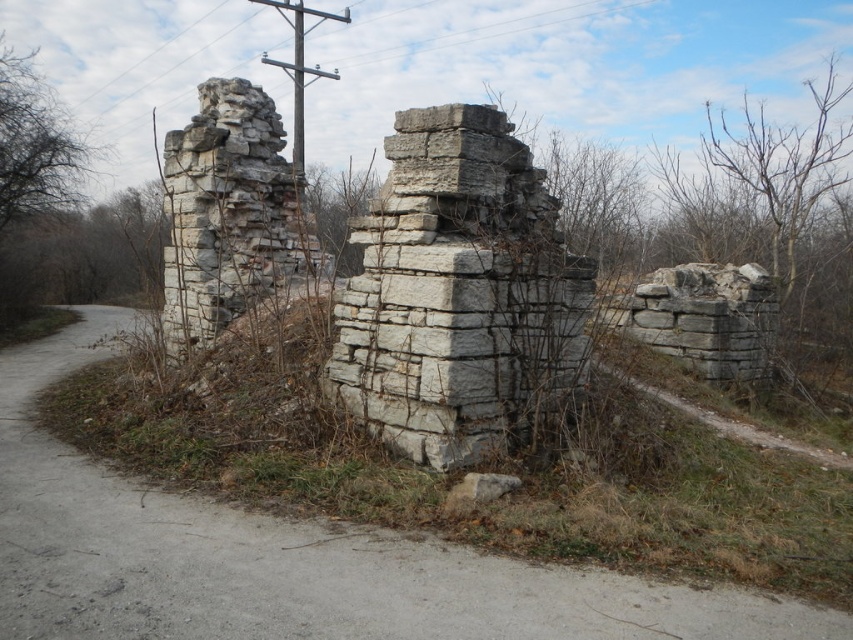
Is gray stone wall at center shorter than gray stone ruins at center?

Yes.

Who is more distant from viewer, (486, 600) or (529, 237)?

The point (529, 237) is behind.

Image resolution: width=853 pixels, height=640 pixels. Find the location of `gray stone wall at center`. gray stone wall at center is located at coordinates (291, 557).

Which is in front, point (326, 269) or point (323, 74)?

Point (326, 269)

Does white stone ruins at left lie behind gray stone telegraph pole at upper center?

No, it is not.

Is point (250, 115) closer to camera compared to point (297, 72)?

Yes, point (250, 115) is in front of point (297, 72).

Locate an element on the screen. The image size is (853, 640). white stone ruins at left is located at coordinates (230, 216).

Does gray stone ruins at center appear on the left side of white stone ruins at left?

Incorrect, gray stone ruins at center is not on the left side of white stone ruins at left.

Is gray stone ruins at center above white stone ruins at left?

No, gray stone ruins at center is not above white stone ruins at left.

Does point (525, 276) come farther from viewer compared to point (215, 269)?

That is False.

Find the location of a particular element. The image size is (853, 640). gray stone ruins at center is located at coordinates (457, 292).